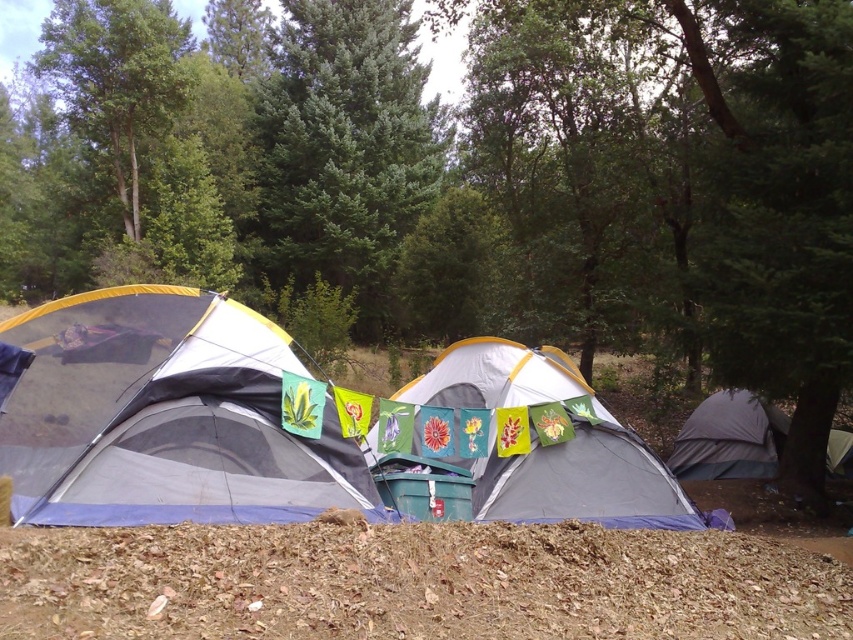
Question: Which object appears closest to the camera in this image?

Choices:
 (A) gray fabric tent at right
 (B) green leafy tree at upper left
 (C) matte gray tent at left

Answer: (C)

Question: Based on their relative distances, which object is farther from the matte gray tent at left?

Choices:
 (A) gray fabric tent at center
 (B) brown dry leaves at lower center
 (C) green fir tree at center
 (D) gray fabric tent at right

Answer: (C)

Question: Can you confirm if brown dry leaves at lower center is bigger than green fir tree at center?

Choices:
 (A) no
 (B) yes

Answer: (A)

Question: Is brown dry leaves at lower center to the right of green fir tree at center from the viewer's perspective?

Choices:
 (A) yes
 (B) no

Answer: (A)

Question: Which point appears closest to the camera in this image?

Choices:
 (A) (689, 545)
 (B) (479, 378)
 (C) (96, 83)

Answer: (A)

Question: Can you confirm if brown dry leaves at lower center is thinner than gray fabric tent at center?

Choices:
 (A) yes
 (B) no

Answer: (B)